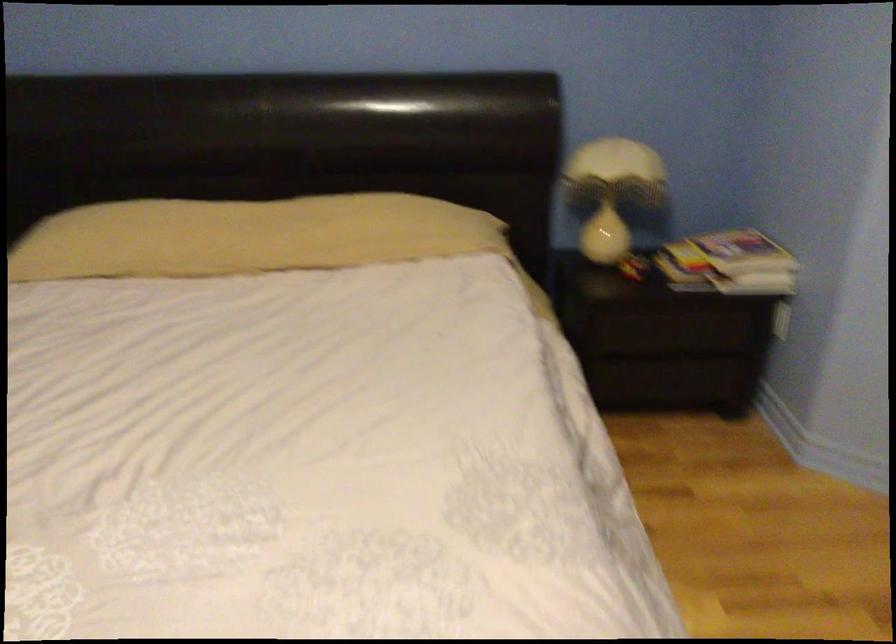
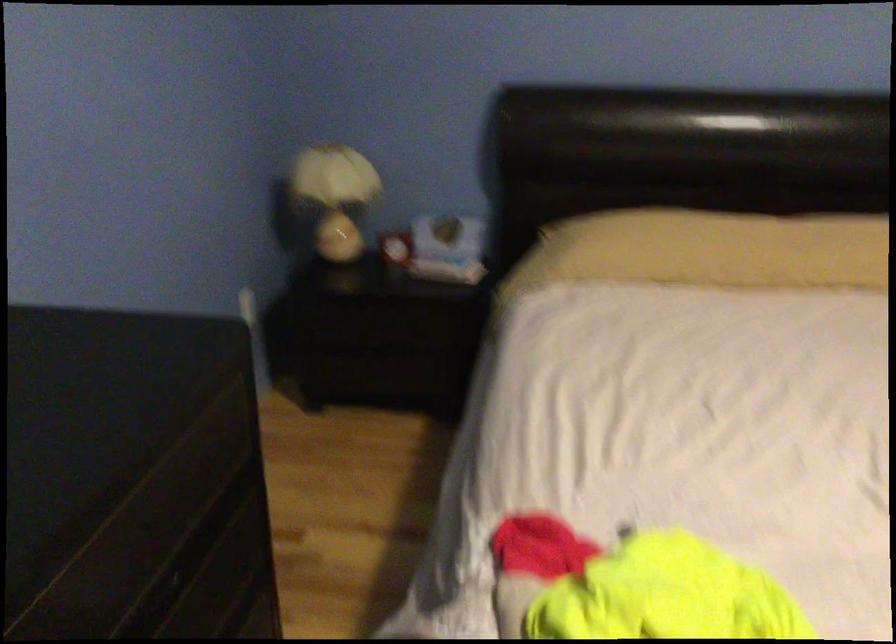
Question: Which direction would the cameraman need to move to produce the second image? Reply with the corresponding letter.

Choices:
 (A) Left
 (B) Right
 (C) Forward
 (D) Backward

Answer: (A)